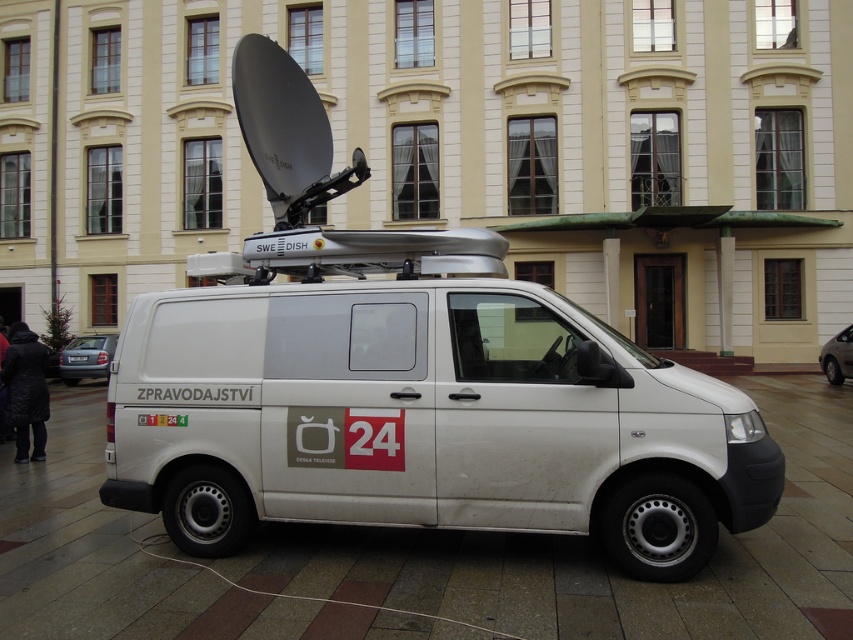
Which is more to the left, matte gray sedan at lower left or metallic silver sedan at right?

From the viewer's perspective, matte gray sedan at lower left appears more on the left side.

From the picture: Does matte gray sedan at lower left have a lesser width compared to metallic silver sedan at right?

Incorrect, matte gray sedan at lower left's width is not less than metallic silver sedan at right's.

The image size is (853, 640). Describe the element at coordinates (86, 356) in the screenshot. I see `matte gray sedan at lower left` at that location.

This screenshot has width=853, height=640. Identify the location of matte gray sedan at lower left. (86, 356).

Between point (647, 502) and point (846, 360), which one is positioned behind?

The point (846, 360) is more distant.

Can you confirm if white matte van at center is shorter than metallic silver sedan at right?

No.

Is point (498, 291) more distant than point (840, 346)?

No, (498, 291) is in front of (840, 346).

Find the location of a particular element. This screenshot has width=853, height=640. white matte van at center is located at coordinates click(x=421, y=406).

Is point (611, 406) less distant than point (106, 337)?

Yes, point (611, 406) is closer to viewer.

Does white matte van at center appear under matte gray sedan at lower left?

Actually, white matte van at center is above matte gray sedan at lower left.

The image size is (853, 640). What do you see at coordinates (421, 406) in the screenshot? I see `white matte van at center` at bounding box center [421, 406].

Identify the location of white matte van at center. (421, 406).